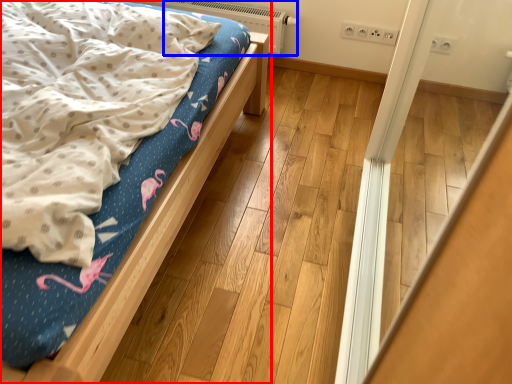
Question: Which object is closer to the camera taking this photo, bed (highlighted by a red box) or heater (highlighted by a blue box)?

Choices:
 (A) bed
 (B) heater

Answer: (A)